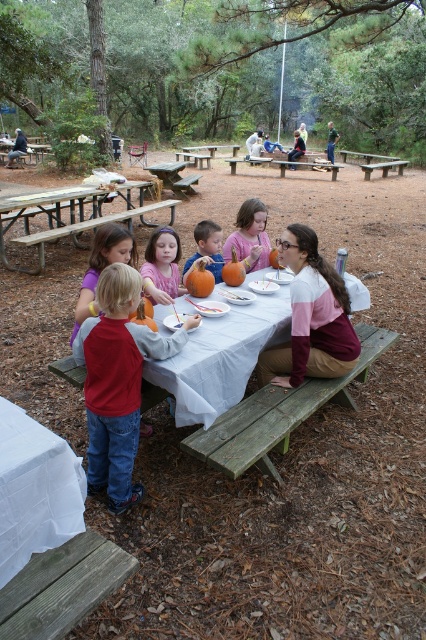
You are a photographer standing at the edge of the picnic table. You want to take a photo of the red cotton shirt at center and the white glossy plate at center. Which object will appear taller in the photo?

The red cotton shirt at center will appear taller in the photo since it has a greater height compared to the white glossy plate at center according to the description.

You are a photographer taking a picture of the scene. You need to focus on the matte pink shirt at center and the white glossy plate at center. Which object should you adjust your camera to focus on first if you want to capture both clearly in the same frame?

The matte pink shirt at center is to the left of the white glossy plate at center. Since they are both at the center, adjusting focus on either would likely capture both, but prioritize the one closer to the camera. However, the description does not specify distance, so focus on both equally.